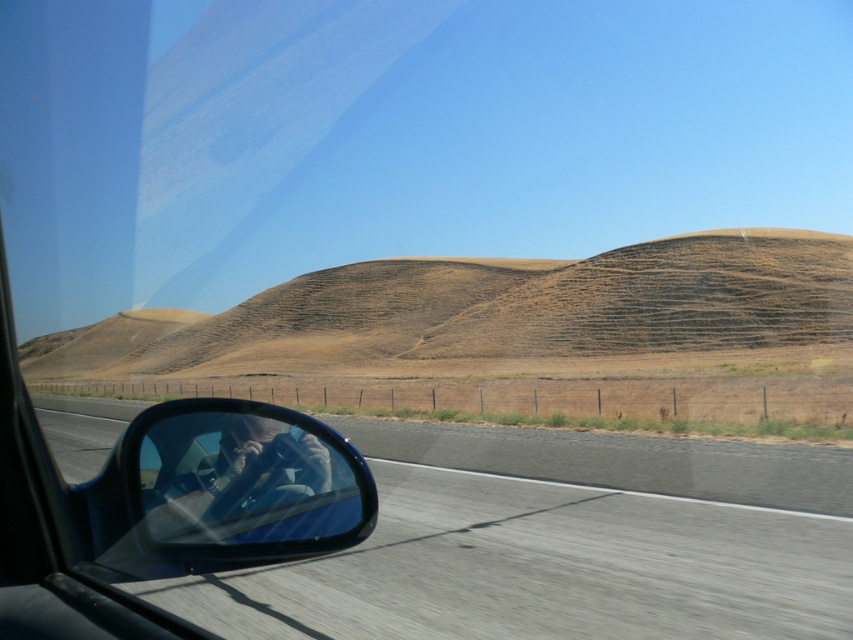
You are a passenger in a car and want to know where the smooth asphalt highway at center is located in the image. Can you tell me its coordinates?

The smooth asphalt highway at center is located at coordinates point (548, 552).

You are a driver checking the side mirror to ensure there is enough space to switch lanes. Given the clear plastic side mirror at lower left and the smooth asphalt highway at center, which object is wider?

The smooth asphalt highway at center is wider than the clear plastic side mirror at lower left according to the description.

You are a passenger in the car and want to point out the smooth asphalt highway at center to the driver. Which direction should you tell them to look relative to the clear plastic side mirror at lower left?

The smooth asphalt highway at center is located to the right of the clear plastic side mirror at lower left, so you should tell the driver to look to the right of the clear plastic side mirror at lower left.